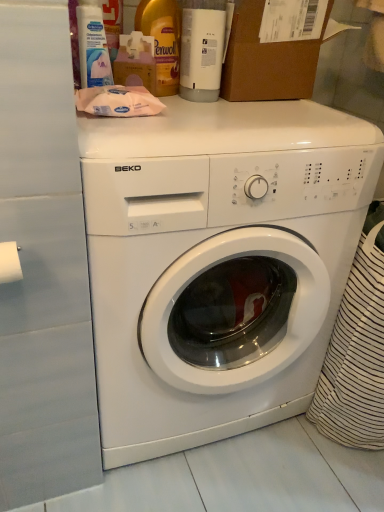
Question: Is white plastic bottle at upper left inside the boundaries of white matte toilet paper at left, or outside?

Choices:
 (A) inside
 (B) outside

Answer: (B)

Question: In terms of height, does white plastic bottle at upper left look taller or shorter compared to white matte toilet paper at left?

Choices:
 (A) tall
 (B) short

Answer: (A)

Question: Which is nearer to the white glossy washing machine at center?

Choices:
 (A) white plastic bottle at upper left
 (B) brown cardboard box at upper center
 (C) white plastic bottle at upper center, which ranks as the first bottle in right-to-left order
 (D) yellow plastic bottle at upper center, the 2th bottle from the right
 (E) white matte toilet paper at left

Answer: (B)

Question: Which of these objects is positioned closest to the white plastic bottle at upper left?

Choices:
 (A) white matte toilet paper at left
 (B) white glossy washing machine at center
 (C) brown cardboard box at upper center
 (D) yellow plastic bottle at upper center, which ranks as the 1th bottle in left-to-right order
 (E) white plastic bottle at upper center, acting as the second bottle starting from the left

Answer: (D)